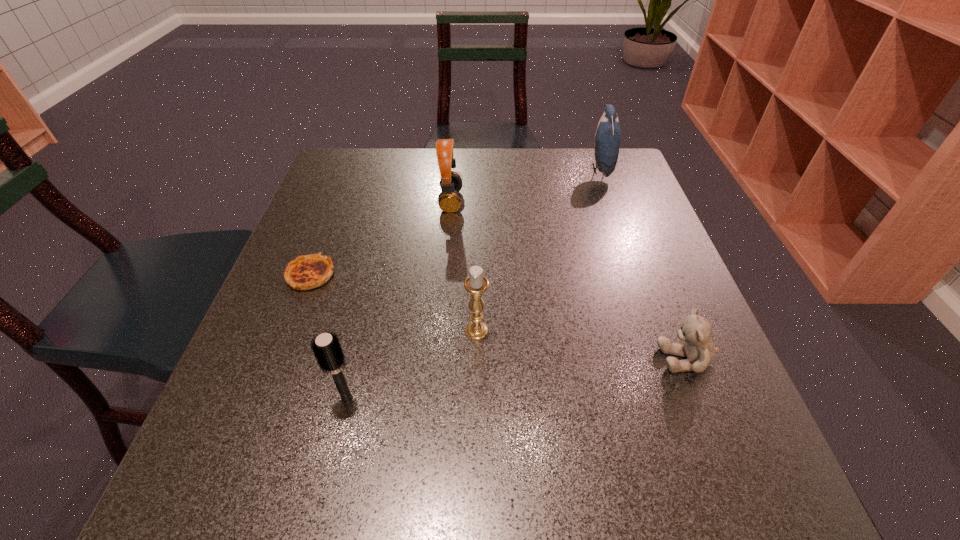
Find the location of a particular element. bird is located at coordinates (608, 134).

The image size is (960, 540). I want to click on the fifth nearest object, so click(x=449, y=200).

Where is `the third object from left to right`? The width and height of the screenshot is (960, 540). the third object from left to right is located at coordinates (449, 200).

Image resolution: width=960 pixels, height=540 pixels. In order to click on candle holder in this screenshot , I will do `click(476, 284)`.

The image size is (960, 540). I want to click on the nearest object, so pos(326,348).

The width and height of the screenshot is (960, 540). What are the coordinates of `the fifth object from right to left` in the screenshot? It's located at (326, 348).

Find the location of `the fifth tallest object`. the fifth tallest object is located at coordinates (699, 349).

Where is `the leftmost object`? the leftmost object is located at coordinates [x=311, y=271].

This screenshot has height=540, width=960. In order to click on the shortest object in this screenshot , I will do `click(311, 271)`.

Where is `free spot located at the tip of the bird's beak`? The height and width of the screenshot is (540, 960). free spot located at the tip of the bird's beak is located at coordinates (513, 169).